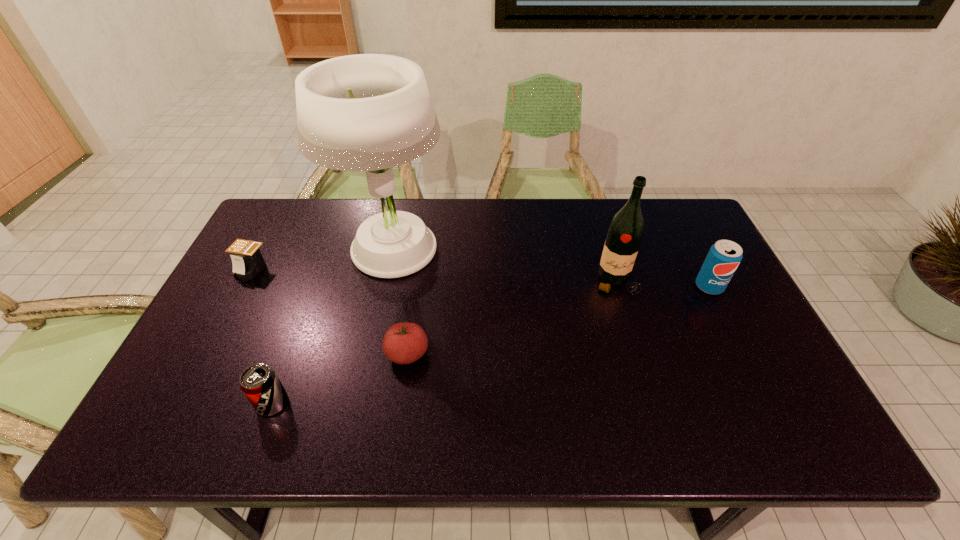
This screenshot has width=960, height=540. In order to click on free spot that satisfies the following two spatial constraints: 1. on the front side of the nearest object; 2. on the right side of the shortest object in this screenshot , I will do `click(181, 403)`.